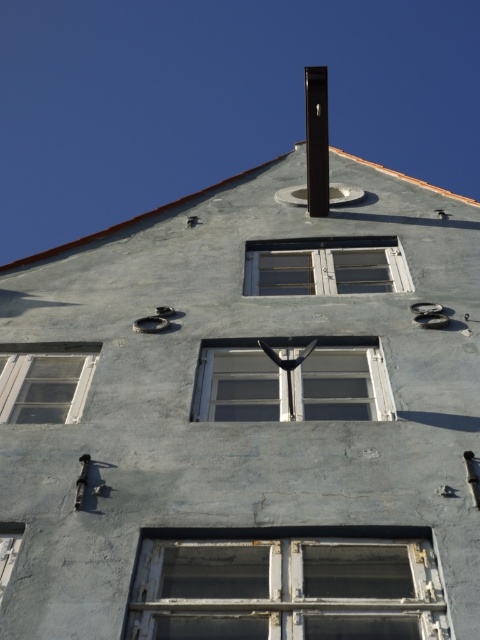
Can you confirm if white wooden window at center is smaller than black matte pole at upper center?

Yes, white wooden window at center is smaller than black matte pole at upper center.

Can you confirm if white wooden window at center is shorter than black matte pole at upper center?

Yes.

Which is behind, point (254, 257) or point (322, 131)?

Positioned behind is point (322, 131).

Image resolution: width=480 pixels, height=640 pixels. In order to click on white wooden window at center in this screenshot , I will do `click(324, 266)`.

Between rusty metal window at lower center and white wooden window at lower left, which one appears on the right side from the viewer's perspective?

From the viewer's perspective, rusty metal window at lower center appears more on the right side.

From the picture: Does rusty metal window at lower center appear on the left side of white wooden window at lower left?

No, rusty metal window at lower center is not to the left of white wooden window at lower left.

Who is more forward, (210, 604) or (12, 544)?

Point (210, 604) is more forward.

Locate an element on the screen. This screenshot has height=640, width=480. rusty metal window at lower center is located at coordinates (287, 584).

Who is lower down, rusty metal window at lower center or transparent glass window at left?

Positioned lower is rusty metal window at lower center.

Is point (430, 532) closer to camera compared to point (63, 412)?

Yes, point (430, 532) is in front of point (63, 412).

This screenshot has height=640, width=480. I want to click on rusty metal window at lower center, so click(287, 584).